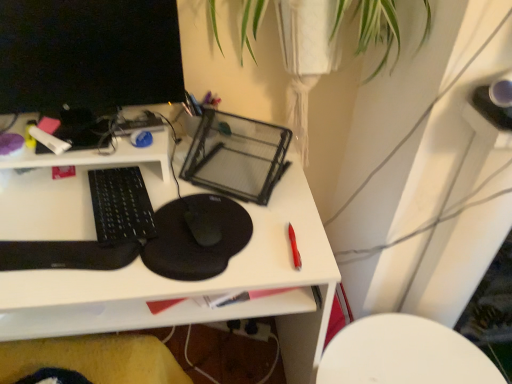
Locate an element on the screen. The height and width of the screenshot is (384, 512). free space that is in between black matte mouse at center and red plastic pen at right, arranged as the second stationery when viewed from the top is located at coordinates (244, 236).